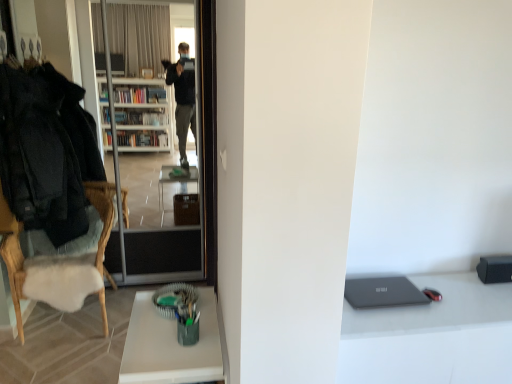
Question: Is point pyautogui.click(x=12, y=180) positioned closer to the camera than point pyautogui.click(x=202, y=337)?

Choices:
 (A) closer
 (B) farther

Answer: (B)

Question: Relative to green matte cup at lower center, is black woolen jacket at left in front or behind?

Choices:
 (A) front
 (B) behind

Answer: (B)

Question: Estimate the real-world distances between objects in this image. Which object is closer to the black woolen jacket at left?

Choices:
 (A) white sheepskin cushion at left
 (B) satin black laptop at right
 (C) transparent glass screen door at left
 (D) matte gray laptop at lower right
 (E) green matte cup at lower center

Answer: (A)

Question: Estimate the real-world distances between objects in this image. Which object is farther from the transparent glass screen door at left?

Choices:
 (A) satin black laptop at right
 (B) white sheepskin cushion at left
 (C) matte gray laptop at lower right
 (D) black woolen jacket at left
 (E) green matte cup at lower center

Answer: (A)